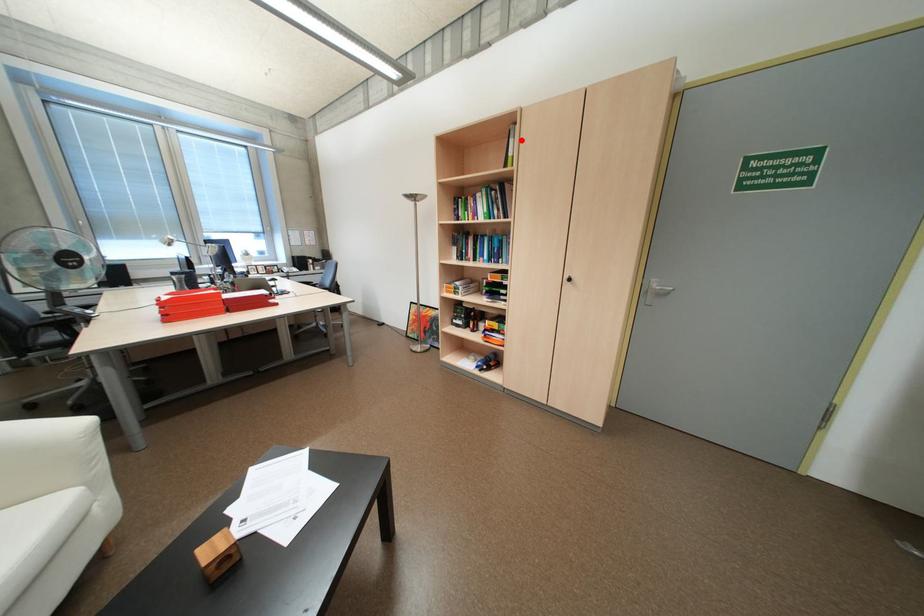
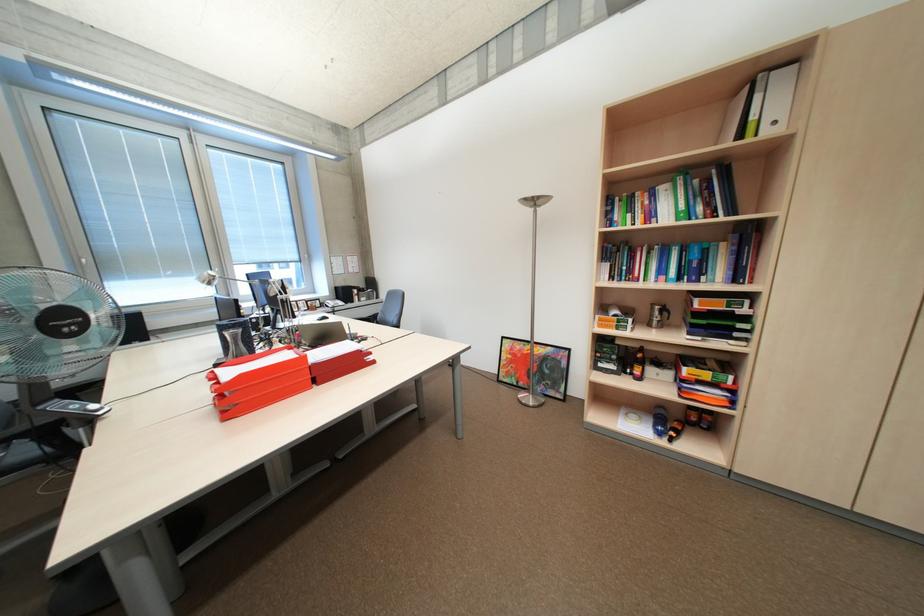
In the second image, find the point that corresponds to the highlighted location in the first image.

(768, 97)